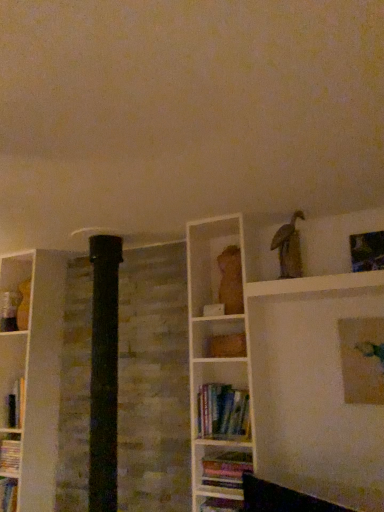
I want to click on hardcover books at center, the second book when ordered from bottom to top, so click(x=223, y=412).

Image resolution: width=384 pixels, height=512 pixels. Describe the element at coordinates (225, 471) in the screenshot. I see `multicolored paper book at lower center, the first book positioned from the bottom` at that location.

What do you see at coordinates (362, 359) in the screenshot? I see `matte gold picture frame at upper right, placed as the 1th picture frame when sorted from bottom to top` at bounding box center [362, 359].

The image size is (384, 512). Find the location of `matte gold picture frame at upper right, placed as the 1th picture frame when sorted from bottom to top`. matte gold picture frame at upper right, placed as the 1th picture frame when sorted from bottom to top is located at coordinates (362, 359).

Find the location of a particular element. The height and width of the screenshot is (512, 384). hardcover books at center, the second book when ordered from bottom to top is located at coordinates (223, 412).

Does matte gold picture frame at upper right, the 2th picture frame from the top, have a lesser width compared to metallic silver picture frame at upper right, which is the second picture frame in bottom-to-top order?

Yes.

Can you confirm if matte gold picture frame at upper right, placed as the 1th picture frame when sorted from bottom to top, is smaller than metallic silver picture frame at upper right, which is the second picture frame in bottom-to-top order?

No.

From the image's perspective, would you say matte gold picture frame at upper right, the 2th picture frame from the top, is positioned over metallic silver picture frame at upper right, which appears as the 1th picture frame when viewed from the top?

No, from the image's perspective, matte gold picture frame at upper right, the 2th picture frame from the top, is not over metallic silver picture frame at upper right, which appears as the 1th picture frame when viewed from the top.

Is matte gold picture frame at upper right, the 2th picture frame from the top, next to metallic silver picture frame at upper right, which is the second picture frame in bottom-to-top order?

No, matte gold picture frame at upper right, the 2th picture frame from the top, is not making contact with metallic silver picture frame at upper right, which is the second picture frame in bottom-to-top order.

From the image's perspective, relative to multicolored paper book at lower center, the first book positioned from the bottom, is matte gold picture frame at upper right, placed as the 1th picture frame when sorted from bottom to top, above or below?

From the image's perspective, matte gold picture frame at upper right, placed as the 1th picture frame when sorted from bottom to top, appears above multicolored paper book at lower center, the first book positioned from the bottom.

Who is bigger, matte gold picture frame at upper right, placed as the 1th picture frame when sorted from bottom to top, or multicolored paper book at lower center, the first book positioned from the bottom?

With larger size is multicolored paper book at lower center, the first book positioned from the bottom.

Is point (352, 336) farther from camera compared to point (226, 464)?

Yes.

In order to click on book that is the 2nd one when counting downward from the matte gold picture frame at upper right, the 2th picture frame from the top (from the image's perspective) in this screenshot , I will do `click(225, 471)`.

Is the depth of metallic silver picture frame at upper right, which is the second picture frame in bottom-to-top order, less than that of multicolored paper book at lower center, which appears as the second book when viewed from the top?

No, metallic silver picture frame at upper right, which is the second picture frame in bottom-to-top order, is further to the viewer.

Choose the correct answer: Is metallic silver picture frame at upper right, which appears as the 1th picture frame when viewed from the top, inside multicolored paper book at lower center, which appears as the second book when viewed from the top, or outside it?

metallic silver picture frame at upper right, which appears as the 1th picture frame when viewed from the top, is outside multicolored paper book at lower center, which appears as the second book when viewed from the top.

Consider the image. From the image's perspective, relative to multicolored paper book at lower center, the first book positioned from the bottom, is metallic silver picture frame at upper right, which is the second picture frame in bottom-to-top order, above or below?

metallic silver picture frame at upper right, which is the second picture frame in bottom-to-top order, is above multicolored paper book at lower center, the first book positioned from the bottom.

What's the angular difference between metallic silver picture frame at upper right, which is the second picture frame in bottom-to-top order, and multicolored paper book at lower center, the first book positioned from the bottom,'s facing directions?

metallic silver picture frame at upper right, which is the second picture frame in bottom-to-top order, and multicolored paper book at lower center, the first book positioned from the bottom, are facing 0.913 degrees away from each other.

Does point (211, 458) come closer to viewer compared to point (230, 420)?

Yes, it is in front of point (230, 420).

Could you tell me if multicolored paper book at lower center, the first book positioned from the bottom, is turned towards hardcover books at center, the second book when ordered from bottom to top?

No, multicolored paper book at lower center, the first book positioned from the bottom, does not turn towards hardcover books at center, the second book when ordered from bottom to top.

Can you see multicolored paper book at lower center, the first book positioned from the bottom, touching hardcover books at center, the second book when ordered from bottom to top?

No, multicolored paper book at lower center, the first book positioned from the bottom, is not next to hardcover books at center, the second book when ordered from bottom to top.

Which is more to the right, hardcover books at center, which is the 1th book in top-to-bottom order, or multicolored paper book at lower center, the first book positioned from the bottom?

From the viewer's perspective, multicolored paper book at lower center, the first book positioned from the bottom, appears more on the right side.

Can you tell me how much hardcover books at center, the second book when ordered from bottom to top, and multicolored paper book at lower center, which appears as the second book when viewed from the top, differ in facing direction?

0.464 degrees.

At what (x,y) coordinates should I click in order to perform the action: click on book above the multicolored paper book at lower center, the first book positioned from the bottom (from a real-world perspective). Please return your answer as a coordinate pair (x, y). Image resolution: width=384 pixels, height=512 pixels. Looking at the image, I should click on (223, 412).

Is hardcover books at center, the second book when ordered from bottom to top, taller or shorter than multicolored paper book at lower center, the first book positioned from the bottom?

In the image, hardcover books at center, the second book when ordered from bottom to top, appears to be taller than multicolored paper book at lower center, the first book positioned from the bottom.

Does hardcover books at center, which is the 1th book in top-to-bottom order, have a larger size compared to matte gold picture frame at upper right, placed as the 1th picture frame when sorted from bottom to top?

Yes, hardcover books at center, which is the 1th book in top-to-bottom order, is bigger than matte gold picture frame at upper right, placed as the 1th picture frame when sorted from bottom to top.

Is hardcover books at center, the second book when ordered from bottom to top, far from matte gold picture frame at upper right, the 2th picture frame from the top?

No, hardcover books at center, the second book when ordered from bottom to top, is in close proximity to matte gold picture frame at upper right, the 2th picture frame from the top.

Which object is thinner, hardcover books at center, the second book when ordered from bottom to top, or matte gold picture frame at upper right, placed as the 1th picture frame when sorted from bottom to top?

matte gold picture frame at upper right, placed as the 1th picture frame when sorted from bottom to top, is thinner.

Which is closer, (365, 237) or (352, 376)?

Point (352, 376)

Is metallic silver picture frame at upper right, which appears as the 1th picture frame when viewed from the top, positioned with its back to matte gold picture frame at upper right, the 2th picture frame from the top?

That's not correct — metallic silver picture frame at upper right, which appears as the 1th picture frame when viewed from the top, is not looking away from matte gold picture frame at upper right, the 2th picture frame from the top.

Does metallic silver picture frame at upper right, which appears as the 1th picture frame when viewed from the top, touch matte gold picture frame at upper right, the 2th picture frame from the top?

metallic silver picture frame at upper right, which appears as the 1th picture frame when viewed from the top, and matte gold picture frame at upper right, the 2th picture frame from the top, are clearly separated.

Find the location of a particular element. The height and width of the screenshot is (512, 384). picture frame located underneath the metallic silver picture frame at upper right, which appears as the 1th picture frame when viewed from the top (from a real-world perspective) is located at coordinates [x=362, y=359].

From a real-world perspective, count 1st picture frames upward from the multicolored paper book at lower center, the first book positioned from the bottom, and point to it. Please provide its 2D coordinates.

[(362, 359)]

When comparing their distances from matte gold picture frame at upper right, placed as the 1th picture frame when sorted from bottom to top, does metallic silver picture frame at upper right, which appears as the 1th picture frame when viewed from the top, or hardcover books at center, which is the 1th book in top-to-bottom order, seem closer?

Among the two, metallic silver picture frame at upper right, which appears as the 1th picture frame when viewed from the top, is located nearer to matte gold picture frame at upper right, placed as the 1th picture frame when sorted from bottom to top.

Consider the image. Considering their positions, is metallic silver picture frame at upper right, which appears as the 1th picture frame when viewed from the top, positioned further to hardcover books at center, the second book when ordered from bottom to top, than matte gold picture frame at upper right, placed as the 1th picture frame when sorted from bottom to top?

metallic silver picture frame at upper right, which appears as the 1th picture frame when viewed from the top, is positioned further to the anchor hardcover books at center, the second book when ordered from bottom to top.

Consider the image. Considering their positions, is hardcover books at center, the second book when ordered from bottom to top, positioned further to metallic silver picture frame at upper right, which appears as the 1th picture frame when viewed from the top, than multicolored paper book at lower center, which appears as the second book when viewed from the top?

The object further to metallic silver picture frame at upper right, which appears as the 1th picture frame when viewed from the top, is multicolored paper book at lower center, which appears as the second book when viewed from the top.

Considering their positions, is hardcover books at center, the second book when ordered from bottom to top, positioned closer to metallic silver picture frame at upper right, which is the second picture frame in bottom-to-top order, than matte gold picture frame at upper right, the 2th picture frame from the top?

The object closer to metallic silver picture frame at upper right, which is the second picture frame in bottom-to-top order, is matte gold picture frame at upper right, the 2th picture frame from the top.

Based on their spatial positions, is multicolored paper book at lower center, the first book positioned from the bottom, or matte gold picture frame at upper right, placed as the 1th picture frame when sorted from bottom to top, further from metallic silver picture frame at upper right, which appears as the 1th picture frame when viewed from the top?

multicolored paper book at lower center, the first book positioned from the bottom, is further to metallic silver picture frame at upper right, which appears as the 1th picture frame when viewed from the top.

In the scene shown: When comparing their distances from hardcover books at center, which is the 1th book in top-to-bottom order, does metallic silver picture frame at upper right, which appears as the 1th picture frame when viewed from the top, or multicolored paper book at lower center, which appears as the second book when viewed from the top, seem further?

metallic silver picture frame at upper right, which appears as the 1th picture frame when viewed from the top, is further to hardcover books at center, which is the 1th book in top-to-bottom order.

When comparing their distances from matte gold picture frame at upper right, placed as the 1th picture frame when sorted from bottom to top, does hardcover books at center, the second book when ordered from bottom to top, or multicolored paper book at lower center, which appears as the second book when viewed from the top, seem closer?

hardcover books at center, the second book when ordered from bottom to top, lies closer to matte gold picture frame at upper right, placed as the 1th picture frame when sorted from bottom to top, than the other object.

When comparing their distances from metallic silver picture frame at upper right, which is the second picture frame in bottom-to-top order, does matte gold picture frame at upper right, placed as the 1th picture frame when sorted from bottom to top, or multicolored paper book at lower center, which appears as the second book when viewed from the top, seem closer?

Among the two, matte gold picture frame at upper right, placed as the 1th picture frame when sorted from bottom to top, is located nearer to metallic silver picture frame at upper right, which is the second picture frame in bottom-to-top order.

I want to click on picture frame between metallic silver picture frame at upper right, which is the second picture frame in bottom-to-top order, and hardcover books at center, the second book when ordered from bottom to top, in the vertical direction, so click(x=362, y=359).

Where is `book between hardcover books at center, which is the 1th book in top-to-bottom order, and matte gold picture frame at upper right, the 2th picture frame from the top`? This screenshot has width=384, height=512. book between hardcover books at center, which is the 1th book in top-to-bottom order, and matte gold picture frame at upper right, the 2th picture frame from the top is located at coordinates (225, 471).

Locate an element on the screen. book between metallic silver picture frame at upper right, which appears as the 1th picture frame when viewed from the top, and multicolored paper book at lower center, which appears as the second book when viewed from the top, in the up-down direction is located at coordinates (223, 412).

The width and height of the screenshot is (384, 512). Find the location of `picture frame that lies between metallic silver picture frame at upper right, which appears as the 1th picture frame when viewed from the top, and multicolored paper book at lower center, the first book positioned from the bottom, from top to bottom`. picture frame that lies between metallic silver picture frame at upper right, which appears as the 1th picture frame when viewed from the top, and multicolored paper book at lower center, the first book positioned from the bottom, from top to bottom is located at coordinates (362, 359).